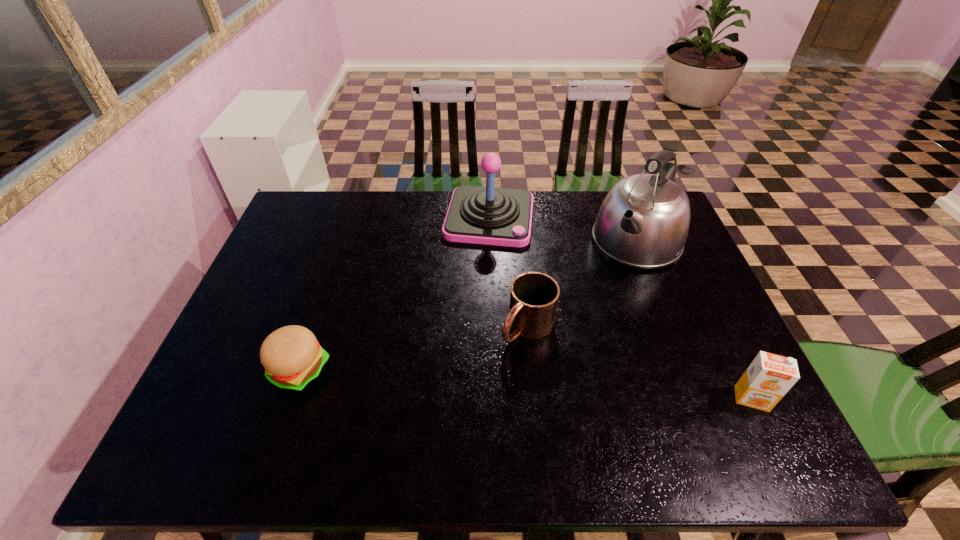
Where is `vacant spot on the desktop that is between the hamburger and the third tallest object and is positioned on the spout of the tallest object`? vacant spot on the desktop that is between the hamburger and the third tallest object and is positioned on the spout of the tallest object is located at coordinates (529, 385).

Find the location of a particular element. free spot on the desktop that is between the hamburger and the third tallest object and is positioned forward from the base of the second tallest object is located at coordinates (458, 381).

This screenshot has width=960, height=540. Find the location of `free space on the desktop that is between the hamburger and the orange juice and is positioned on the side of the mug with the handle`. free space on the desktop that is between the hamburger and the orange juice and is positioned on the side of the mug with the handle is located at coordinates (472, 381).